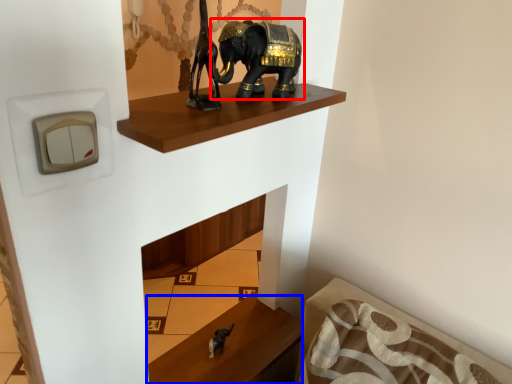
Question: Among these objects, which one is farthest to the camera, elephant (highlighted by a red box) or furniture (highlighted by a blue box)?

Choices:
 (A) elephant
 (B) furniture

Answer: (B)